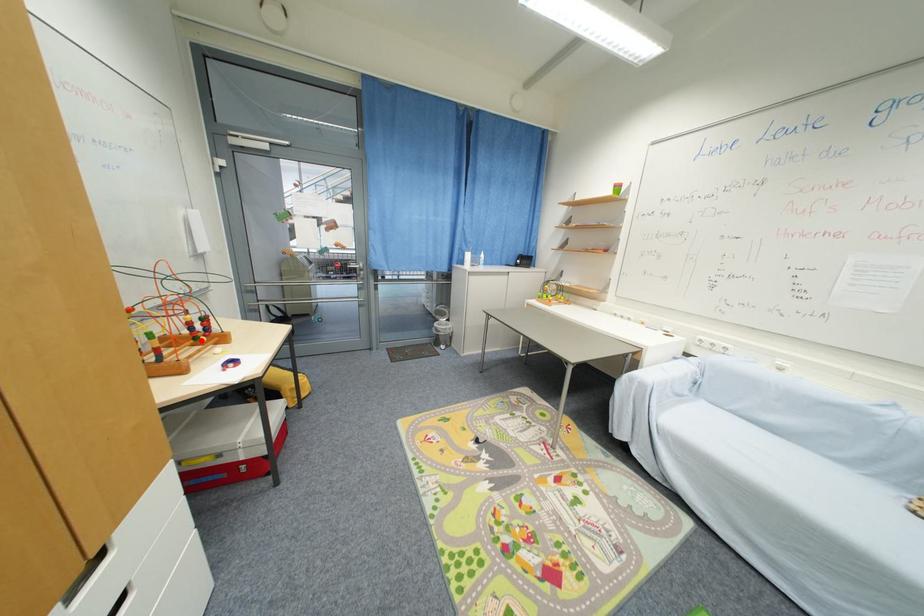
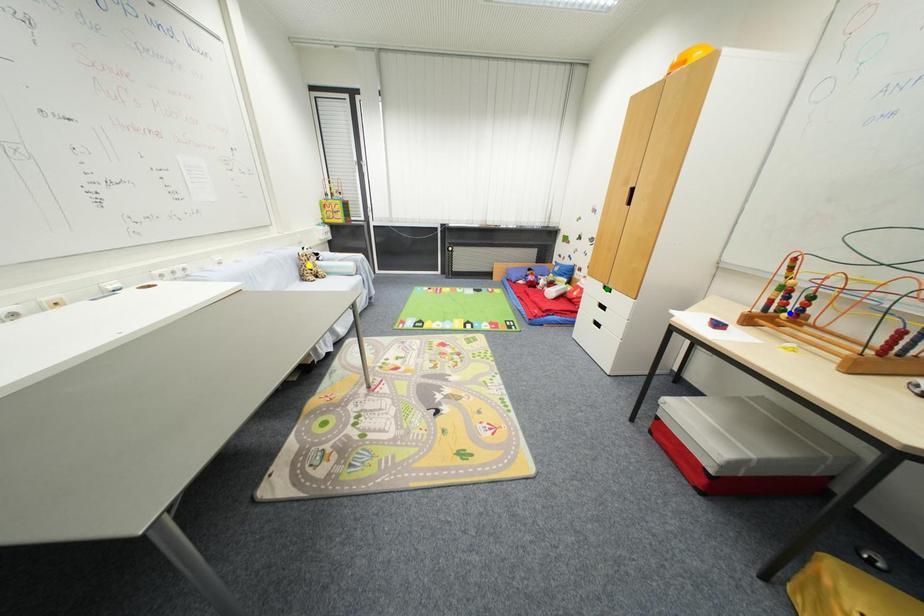
Question: I am providing you with two images of the same scene from different viewpoints. A red point is marked on the first image. You are given multiple points on the second image. Which point in image 2 is actually the same real-world point as the red point in image 1?

Choices:
 (A) blue point
 (B) green point
 (C) yellow point

Answer: (A)